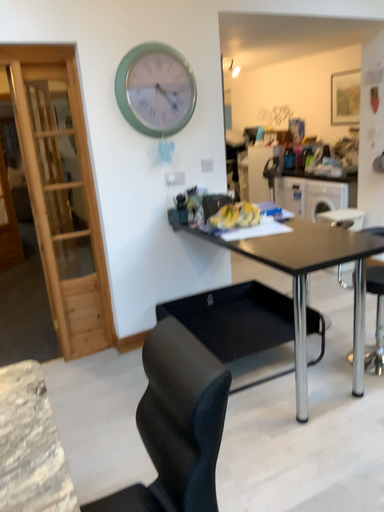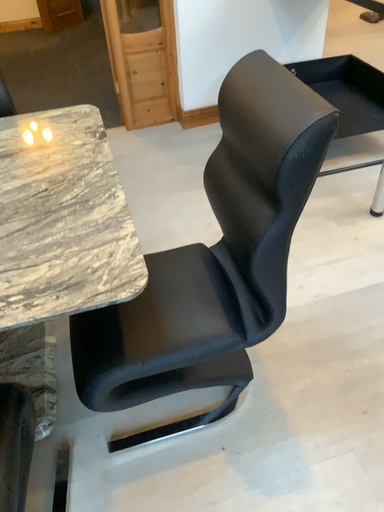
Question: Which way did the camera rotate in the video?

Choices:
 (A) rotated right
 (B) rotated left

Answer: (B)